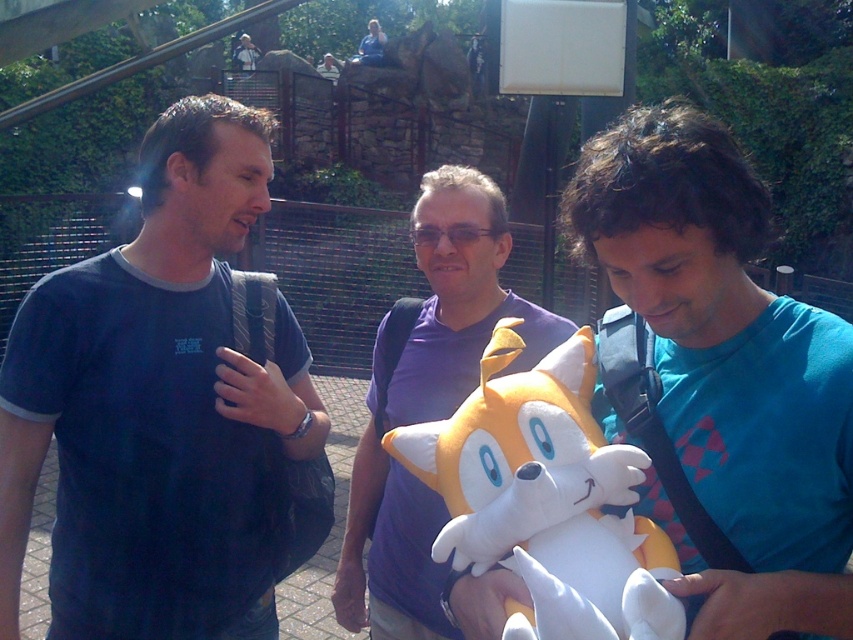
Question: Can you confirm if dark blue t-shirt at left is smaller than purple fabric shirt at center?

Choices:
 (A) no
 (B) yes

Answer: (B)

Question: Is dark blue t-shirt at left bigger than white plush toy at center?

Choices:
 (A) yes
 (B) no

Answer: (A)

Question: Can you confirm if blue cotton shirt at center is smaller than white plush toy at center?

Choices:
 (A) yes
 (B) no

Answer: (B)

Question: Which of the following is the closest to the observer?

Choices:
 (A) (703, 241)
 (B) (602, 595)
 (C) (408, 538)
 (D) (161, 272)

Answer: (B)

Question: Which of the following is the farthest from the observer?

Choices:
 (A) (405, 620)
 (B) (807, 371)
 (C) (80, 467)
 (D) (515, 500)

Answer: (A)

Question: Which object is closer to the camera taking this photo?

Choices:
 (A) purple fabric shirt at center
 (B) blue cotton shirt at center
 (C) dark blue t-shirt at left
 (D) white plush toy at center

Answer: (D)